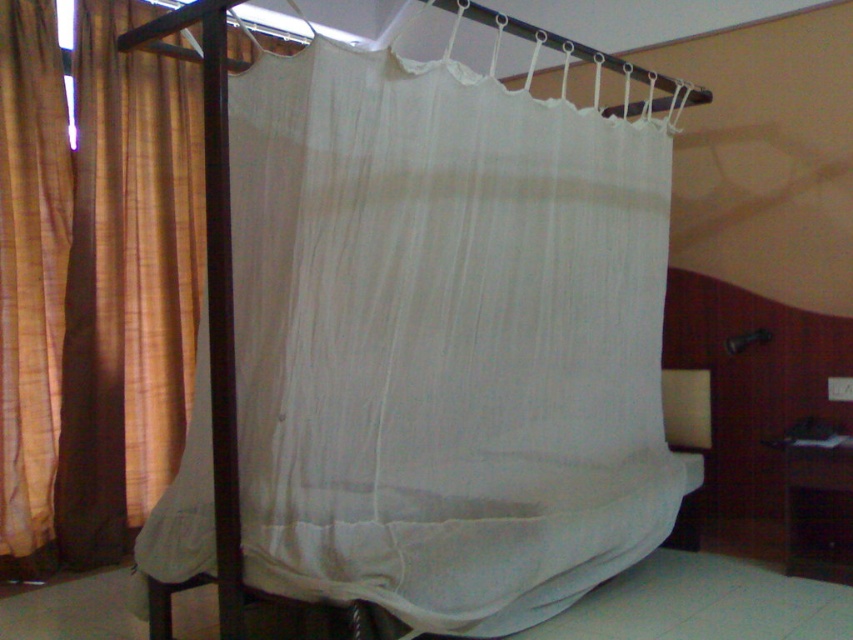
You have a bedspread that needs to cover both the white cotton sheet at center and the brown textured fabric at left. Which fabric should you place under the bedspread to ensure full coverage?

The white cotton sheet at center should be placed under the bedspread because its width is larger than the brown textured fabric at left, ensuring better coverage.

You are standing in the room and want to move from the brown textured fabric at left to the white cotton sheet at center. Which direction should you move?

You should move to the right to reach the white cotton sheet at center from the brown textured fabric at left since it is positioned to the right of it.

From the picture: You are packing for a trip and need to decide which item to take. You have the white cotton sheet at center and the brown textured fabric at left. Which one can you fit into your small suitcase if the sheet is too big?

The brown textured fabric at left can fit into the small suitcase since it is smaller in size than the white cotton sheet at center.